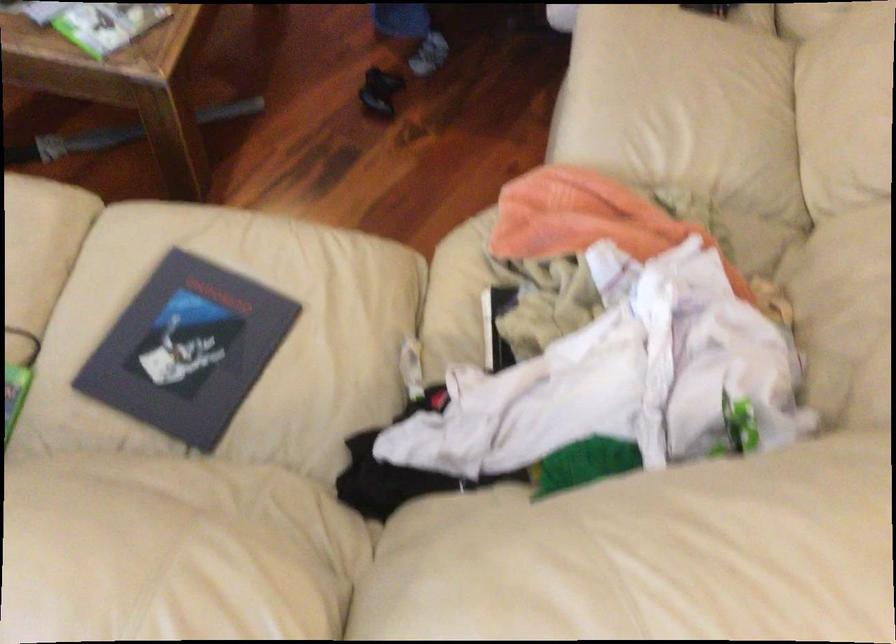
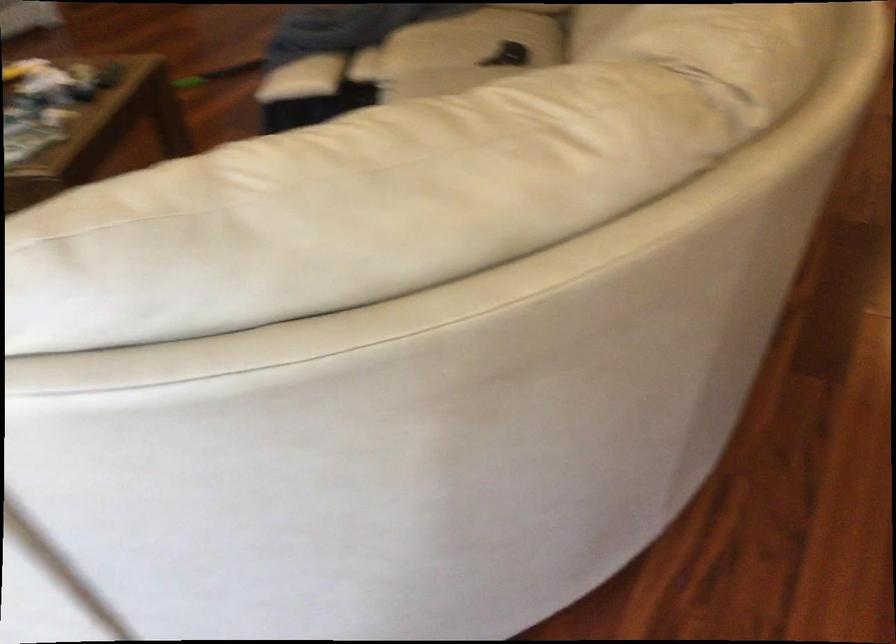
Question: What movement of the cameraman would produce the second image?

Choices:
 (A) Left
 (B) Right
 (C) Forward
 (D) Backward

Answer: (B)